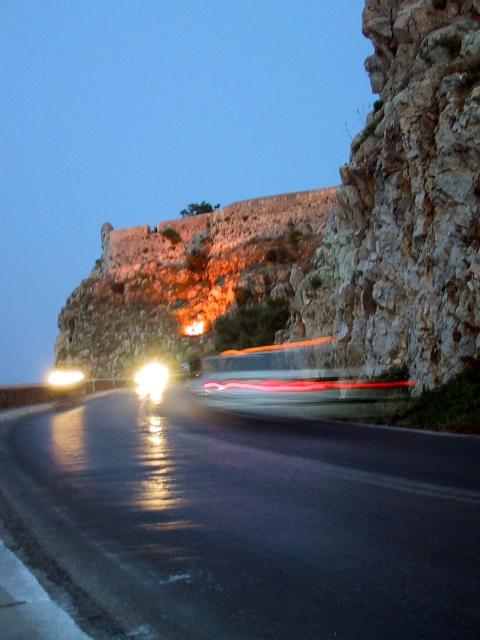
Question: Is black asphalt road at center positioned at the back of metallic silver bus at center?

Choices:
 (A) yes
 (B) no

Answer: (B)

Question: Considering the relative positions of stone wall at upper center and rocky cliff at right in the image provided, where is stone wall at upper center located with respect to rocky cliff at right?

Choices:
 (A) above
 (B) below

Answer: (A)

Question: Which object is positioned farthest from the bright white plastic headlight at center?

Choices:
 (A) metallic silver bus at center
 (B) black asphalt road at center
 (C) stone wall at upper center

Answer: (C)

Question: Which point is closer to the camera?

Choices:
 (A) metallic silver bus at center
 (B) bright white plastic headlight at center
 (C) rocky cliff at right
 (D) stone wall at upper center

Answer: (A)

Question: Does rocky cliff at right appear under bright white plastic headlight at center?

Choices:
 (A) no
 (B) yes

Answer: (A)

Question: Which point is farther to the camera?

Choices:
 (A) metallic silver bus at center
 (B) rocky cliff at right

Answer: (B)